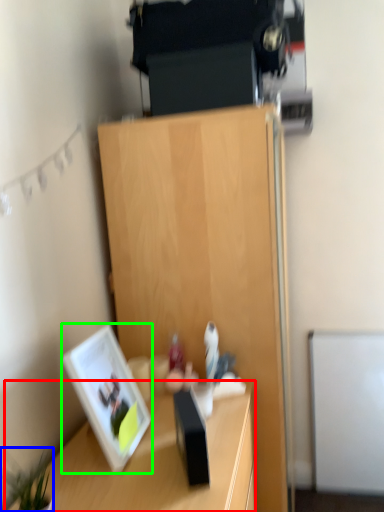
Question: Which object is positioned farthest from desk (highlighted by a red box)? Select from plant (highlighted by a blue box) and picture frame (highlighted by a green box).

Choices:
 (A) plant
 (B) picture frame

Answer: (A)